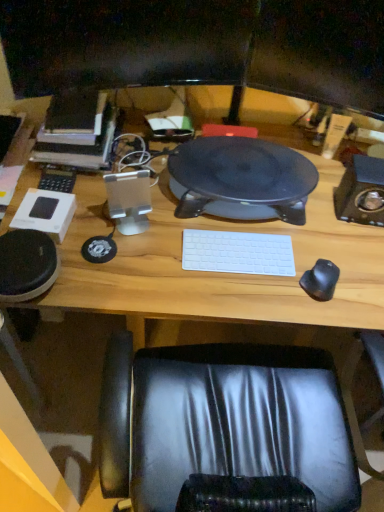
Locate an element on the screen. Image resolution: width=384 pixels, height=512 pixels. vacant space in front of black plastic speaker at center is located at coordinates (225, 272).